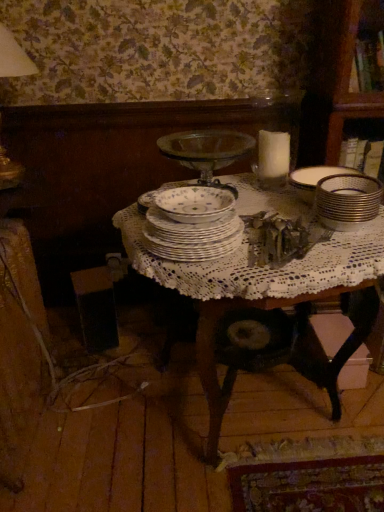
Question: Is gold metallic stack at right situated inside porcelain floral bowl at center or outside?

Choices:
 (A) outside
 (B) inside

Answer: (A)

Question: Considering the positions of gold metallic stack at right and porcelain floral bowl at center in the image, is gold metallic stack at right taller or shorter than porcelain floral bowl at center?

Choices:
 (A) tall
 (B) short

Answer: (A)

Question: Which is farther from the gold metallic stack at right?

Choices:
 (A) white lace tablecloth at center
 (B) porcelain plates at center
 (C) porcelain floral bowl at center

Answer: (B)

Question: Considering the real-world distances, which object is closest to the porcelain plates at center?

Choices:
 (A) white lace tablecloth at center
 (B) gold metallic stack at right
 (C) porcelain floral bowl at center

Answer: (C)